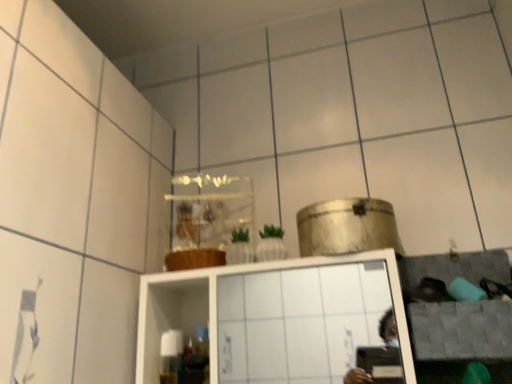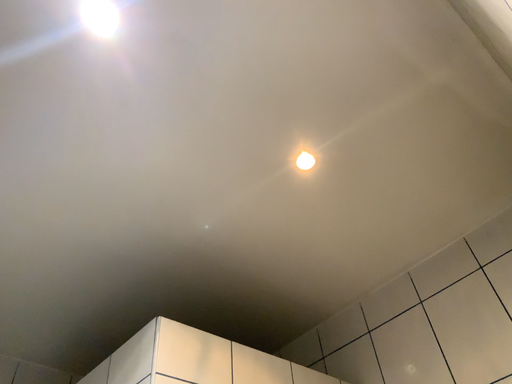
Question: Which way did the camera rotate in the video?

Choices:
 (A) rotated downward
 (B) rotated upward

Answer: (B)